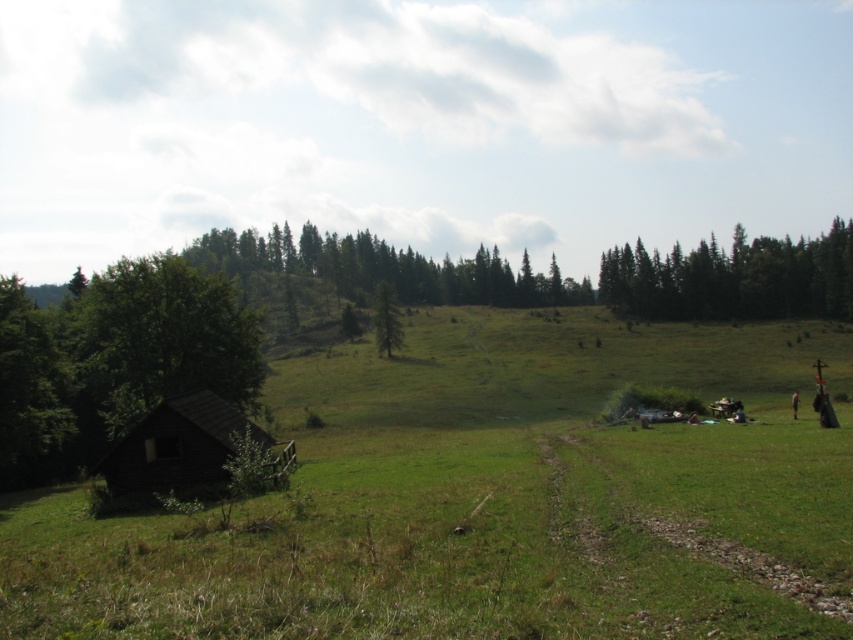
Image resolution: width=853 pixels, height=640 pixels. Describe the element at coordinates (158, 340) in the screenshot. I see `green leafy tree at left` at that location.

Looking at this image, is green leafy tree at left taller than brown wooden hut at lower left?

Indeed, green leafy tree at left has a greater height compared to brown wooden hut at lower left.

The width and height of the screenshot is (853, 640). Describe the element at coordinates (158, 340) in the screenshot. I see `green leafy tree at left` at that location.

The height and width of the screenshot is (640, 853). Identify the location of green leafy tree at left. (158, 340).

Is point (393, 248) farther from camera compared to point (383, 310)?

Yes.

Which is behind, point (328, 257) or point (395, 336)?

Positioned behind is point (328, 257).

Locate an element on the screen. The height and width of the screenshot is (640, 853). green coniferous trees at center is located at coordinates (386, 268).

The width and height of the screenshot is (853, 640). What are the coordinates of `green coniferous trees at center` in the screenshot? It's located at (386, 268).

Who is more forward, (817, 307) or (543, 298)?

Point (817, 307) is in front.

Is green coniferous trees at upper right smaller than green coniferous trees at center?

Correct, green coniferous trees at upper right occupies less space than green coniferous trees at center.

Between point (766, 275) and point (193, 244), which one is positioned in front?

Positioned in front is point (766, 275).

Image resolution: width=853 pixels, height=640 pixels. Find the location of `green coniferous trees at upper right`. green coniferous trees at upper right is located at coordinates (733, 278).